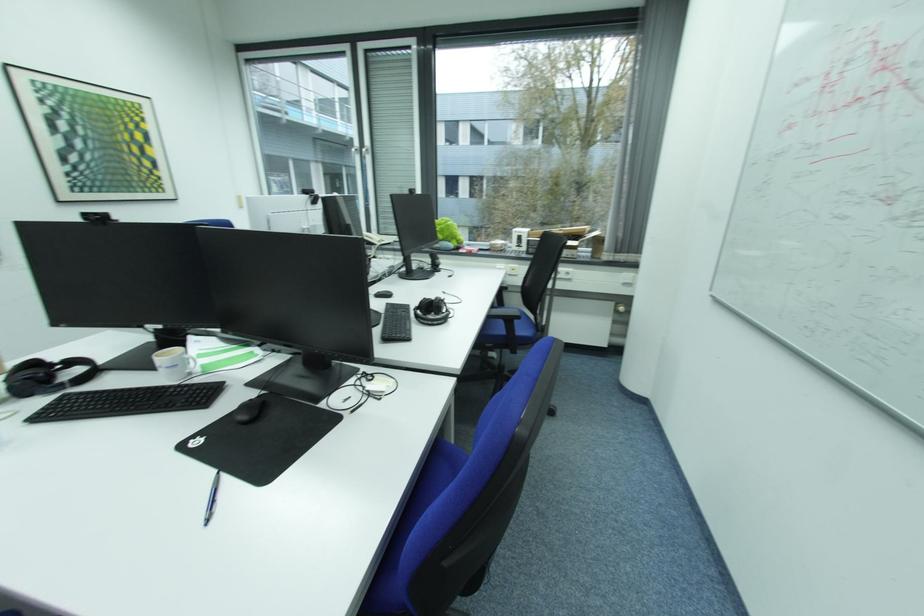
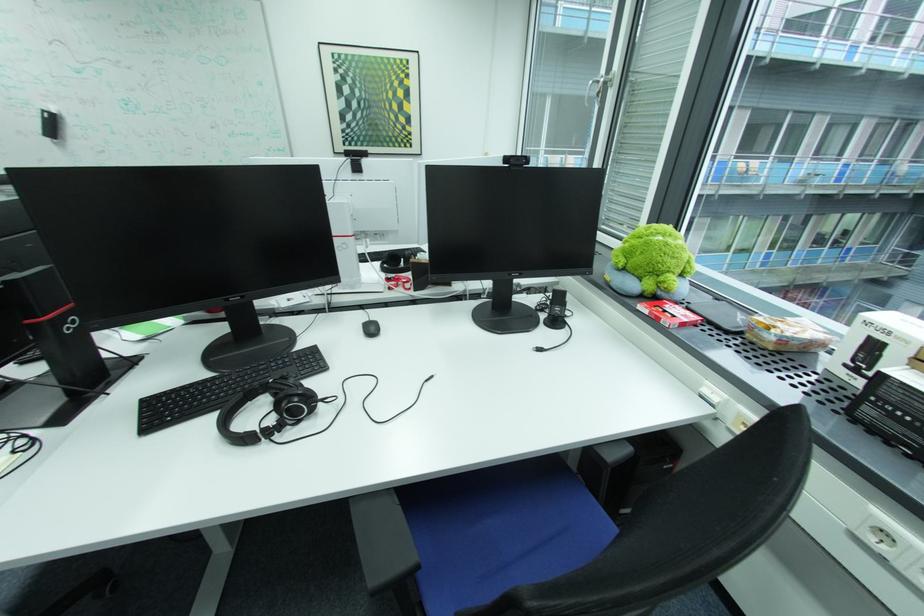
Find the pixel in the second image that matches the point at 66,201 in the first image.

(344, 153)